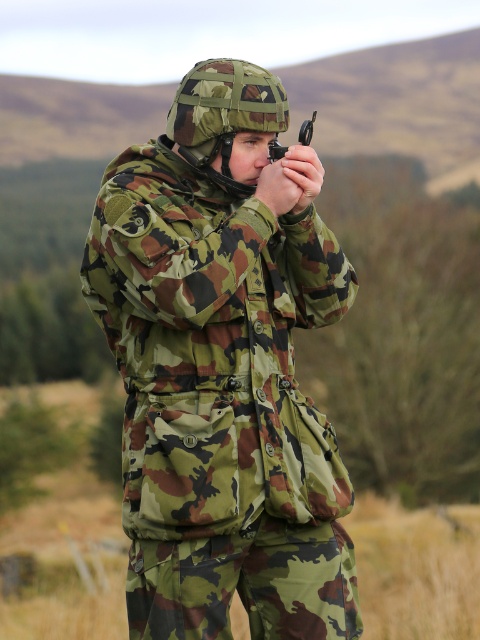
You are a photographer trying to capture a closeup shot of the matte black scope at center. The camera you have can only focus on objects within 25 inches. You are currently positioned at the camo fabric uniform at center. Can you take the photo without moving closer?

The camo fabric uniform at center is 28.82 inches from the matte black scope at center. Since the camera can only focus within 25 inches, you need to move closer to ensure the matte black scope at center is within range.

You are a photographer trying to capture a clear photo of the matte black scope at center. However, the camo fabric uniform at center is blocking your view. Can you move around to the left side to get a better shot? Explain why or why not based on their positions.

The camo fabric uniform at center is further to the viewer than the matte black scope at center. Moving to the left side might not help because the uniform is closer to you, so it would still block the view of the scope unless you move to a position where the uniform is no longer in front of the scope.

Consider the image. You are a photographer trying to capture a clear image of the matte black scope at center. However, the camo fabric uniform at center is blocking your view. Can you determine if the uniform is above or below the scope to adjust your camera angle?

The camo fabric uniform at center is below the matte black scope at center, so you should adjust your camera angle upwards to avoid the obstruction caused by the uniform.